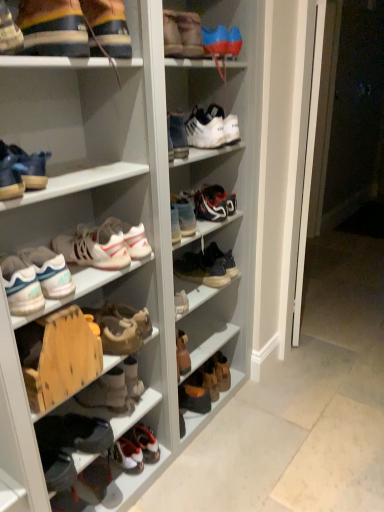
Question: Considering the positions of white matte sneaker at upper center, the 2th footwear viewed from the top, and shiny blue sneakers at center, acting as the tenth footwear starting from the bottom, in the image, is white matte sneaker at upper center, the 2th footwear viewed from the top, wider or thinner than shiny blue sneakers at center, acting as the tenth footwear starting from the bottom,?

Choices:
 (A) wide
 (B) thin

Answer: (A)

Question: From the image's perspective, is white matte sneaker at upper center, which is the thirteenth footwear from bottom to top, positioned above or below shiny blue sneakers at center, acting as the tenth footwear starting from the bottom?

Choices:
 (A) above
 (B) below

Answer: (A)

Question: Estimate the real-world distances between objects in this image. Which object is farther from the matte black sneaker at upper left, marked as the 14th footwear in a bottom-to-top arrangement?

Choices:
 (A) brown suede boot at lower center, acting as the thirteenth footwear starting from the top
 (B) matte blue sneakers at upper left, acting as the 4th footwear starting from the top
 (C) white matte sneakers at left, positioned as the fourth footwear in bottom-to-top order
 (D) white matte sneakers at center, which is the eighth footwear in bottom-to-top order
 (E) white matte sneaker at upper center, which is the thirteenth footwear from bottom to top

Answer: (A)

Question: Estimate the real-world distances between objects in this image. Which object is farther from the white matte sneaker at center, which ranks as the 12th footwear in bottom-to-top order?

Choices:
 (A) shiny blue sneakers at center, acting as the tenth footwear starting from the bottom
 (B) white leather sneakers at center, which appears as the seventh footwear when ordered from the bottom
 (C) matte blue shoe at left, placed as the ninth footwear when sorted from bottom to top
 (D) brown suede boot at lower center, which ranks as the second footwear in bottom-to-top order
 (E) brown suede boots at center, which is the twelfth footwear in top-to-bottom order

Answer: (D)